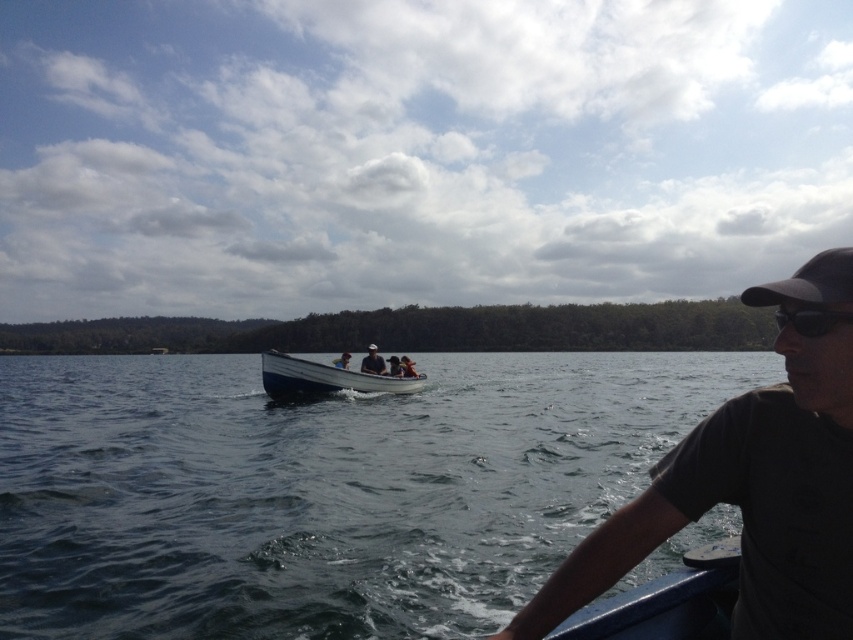
Question: Which of the following is the farthest from the observer?

Choices:
 (A) (787, 317)
 (B) (374, 369)

Answer: (B)

Question: Is black plastic goggles at right smaller than matte black shirt at center?

Choices:
 (A) yes
 (B) no

Answer: (A)

Question: Which point appears closest to the camera in this image?

Choices:
 (A) (381, 387)
 (B) (793, 481)
 (C) (804, 336)
 (D) (376, 362)

Answer: (C)

Question: Does clear water at center lie in front of dark gray t-shirt at right?

Choices:
 (A) no
 (B) yes

Answer: (A)

Question: Can you confirm if clear water at center is positioned to the left of black plastic goggles at right?

Choices:
 (A) yes
 (B) no

Answer: (B)

Question: Considering the real-world distances, which object is closest to the white wood boat at center?

Choices:
 (A) clear water at center
 (B) black plastic goggles at right

Answer: (B)